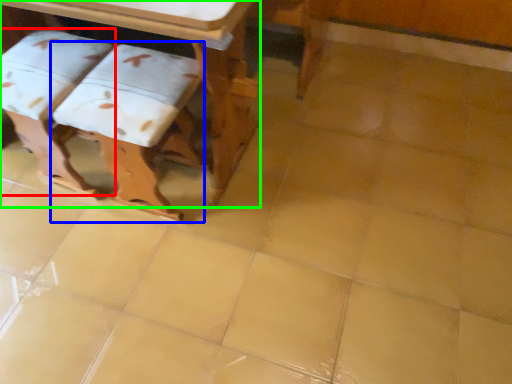
Question: Which is nearer to the step stool (highlighted by a red box)? step stool (highlighted by a blue box) or table (highlighted by a green box).

Choices:
 (A) step stool
 (B) table

Answer: (A)